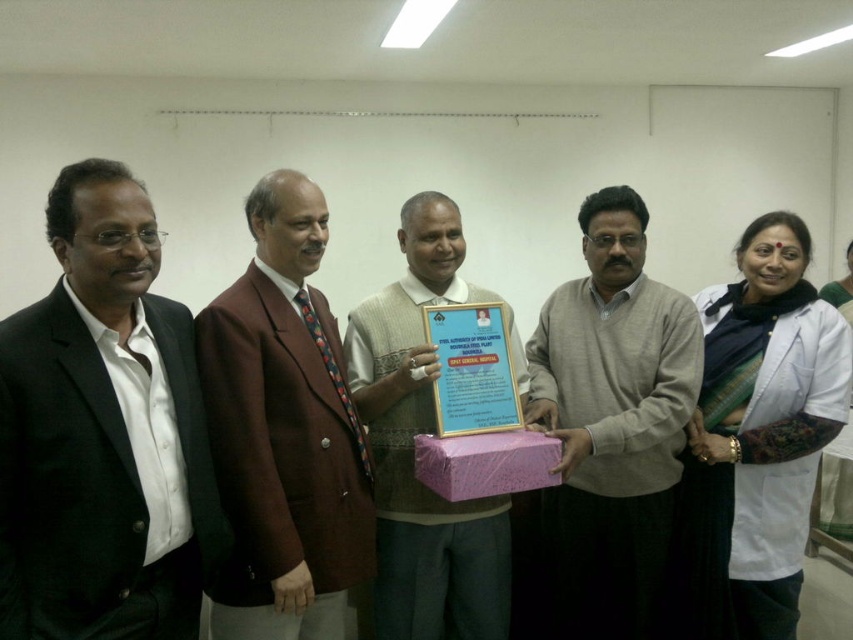
You are organizing a charity event and need to display two items from the scene. The light gray sweater at center and the matte brown vest at center must be placed on a table. Which item requires a larger space on the table?

The light gray sweater at center requires a larger space on the table because it is bigger than the matte brown vest at center.

You are organizing a gift delivery at the event. The gift is a pink paper box at center, and there is a brown woolen blazer at center in the way. Can you place the gift directly in front of the recipient without moving the blazer?

The brown woolen blazer at center is in front of the pink paper box at center, so moving the blazer would be necessary to place the gift directly in front of the recipient.

Based on the scene description, where is the light gray sweater at center located in terms of its 2D coordinates?

The light gray sweater at center is located at the 2D coordinates of point (604, 435).